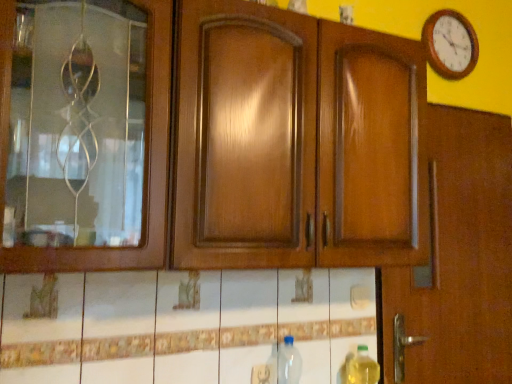
Image resolution: width=512 pixels, height=384 pixels. What do you see at coordinates (450, 44) in the screenshot?
I see `wooden clock at upper right` at bounding box center [450, 44].

Where is `transparent plastic bottle at lower center, which is counted as the 2th bottle, starting from the right`? The image size is (512, 384). transparent plastic bottle at lower center, which is counted as the 2th bottle, starting from the right is located at coordinates (289, 362).

The width and height of the screenshot is (512, 384). Identify the location of yellow translucent bottle at lower right, arranged as the first bottle when viewed from the right. (362, 368).

From the image's perspective, is wooden clock at upper right on top of transparent plastic bottle at lower center, arranged as the first bottle when viewed from the left?

Yes.

From a real-world perspective, between wooden clock at upper right and transparent plastic bottle at lower center, which is counted as the 2th bottle, starting from the right, who is vertically higher?

wooden clock at upper right is physically above.

Which bottle is the 2nd one when counting from the front of the wooden clock at upper right? Please provide its 2D coordinates.

[(289, 362)]

Is wooden clock at upper right positioned before transparent plastic bottle at lower center, which is counted as the 2th bottle, starting from the right?

No, the depth of wooden clock at upper right is greater than that of transparent plastic bottle at lower center, which is counted as the 2th bottle, starting from the right.

Could you tell me if yellow translucent bottle at lower right, which is the second bottle from left to right, is facing transparent plastic bottle at lower center, arranged as the first bottle when viewed from the left?

No, yellow translucent bottle at lower right, which is the second bottle from left to right, is not aimed at transparent plastic bottle at lower center, arranged as the first bottle when viewed from the left.

From the image's perspective, who appears lower, yellow translucent bottle at lower right, arranged as the first bottle when viewed from the right, or transparent plastic bottle at lower center, which is counted as the 2th bottle, starting from the right?

yellow translucent bottle at lower right, arranged as the first bottle when viewed from the right, is shown below in the image.

Visually, is yellow translucent bottle at lower right, which is the second bottle from left to right, positioned to the left or to the right of transparent plastic bottle at lower center, which is counted as the 2th bottle, starting from the right?

Based on their positions, yellow translucent bottle at lower right, which is the second bottle from left to right, is located to the right of transparent plastic bottle at lower center, which is counted as the 2th bottle, starting from the right.

Considering the sizes of objects yellow translucent bottle at lower right, arranged as the first bottle when viewed from the right, and transparent plastic bottle at lower center, arranged as the first bottle when viewed from the left, in the image provided, who is wider, yellow translucent bottle at lower right, arranged as the first bottle when viewed from the right, or transparent plastic bottle at lower center, arranged as the first bottle when viewed from the left,?

transparent plastic bottle at lower center, arranged as the first bottle when viewed from the left, is wider.

Considering the positions of points (462, 46) and (362, 345), is point (462, 46) farther from camera compared to point (362, 345)?

Yes, point (462, 46) is farther from viewer.

Visually, is wooden clock at upper right positioned to the left or to the right of yellow translucent bottle at lower right, arranged as the first bottle when viewed from the right?

Clearly, wooden clock at upper right is on the right of yellow translucent bottle at lower right, arranged as the first bottle when viewed from the right, in the image.

Consider the image. Are wooden clock at upper right and yellow translucent bottle at lower right, arranged as the first bottle when viewed from the right, located far from each other?

Yes.

Is transparent plastic bottle at lower center, arranged as the first bottle when viewed from the left, taller than yellow translucent bottle at lower right, which is the second bottle from left to right?

Correct, transparent plastic bottle at lower center, arranged as the first bottle when viewed from the left, is much taller as yellow translucent bottle at lower right, which is the second bottle from left to right.

Is point (286, 360) closer or farther from the camera than point (349, 366)?

Clearly, point (286, 360) is closer to the camera than point (349, 366).

From the image's perspective, which is above, transparent plastic bottle at lower center, which is counted as the 2th bottle, starting from the right, or yellow translucent bottle at lower right, arranged as the first bottle when viewed from the right?

transparent plastic bottle at lower center, which is counted as the 2th bottle, starting from the right, is shown above in the image.

What's the angular difference between transparent plastic bottle at lower center, which is counted as the 2th bottle, starting from the right, and yellow translucent bottle at lower right, arranged as the first bottle when viewed from the right,'s facing directions?

transparent plastic bottle at lower center, which is counted as the 2th bottle, starting from the right, and yellow translucent bottle at lower right, arranged as the first bottle when viewed from the right, are facing 0.000306 degrees away from each other.

From the image's perspective, is transparent plastic bottle at lower center, which is counted as the 2th bottle, starting from the right, located above or below wooden clock at upper right?

Based on their image positions, transparent plastic bottle at lower center, which is counted as the 2th bottle, starting from the right, is located beneath wooden clock at upper right.

How different are the orientations of transparent plastic bottle at lower center, which is counted as the 2th bottle, starting from the right, and wooden clock at upper right in degrees?

0.00437 degrees.

Looking at this image, which object is positioned more to the left, transparent plastic bottle at lower center, which is counted as the 2th bottle, starting from the right, or wooden clock at upper right?

transparent plastic bottle at lower center, which is counted as the 2th bottle, starting from the right.

Does point (286, 381) come closer to viewer compared to point (452, 16)?

Yes, point (286, 381) is in front of point (452, 16).

Does yellow translucent bottle at lower right, arranged as the first bottle when viewed from the right, have a lesser width compared to wooden clock at upper right?

Incorrect, the width of yellow translucent bottle at lower right, arranged as the first bottle when viewed from the right, is not less than that of wooden clock at upper right.

Can you confirm if yellow translucent bottle at lower right, arranged as the first bottle when viewed from the right, is smaller than wooden clock at upper right?

Indeed, yellow translucent bottle at lower right, arranged as the first bottle when viewed from the right, has a smaller size compared to wooden clock at upper right.

Considering the sizes of objects yellow translucent bottle at lower right, arranged as the first bottle when viewed from the right, and wooden clock at upper right in the image provided, who is taller, yellow translucent bottle at lower right, arranged as the first bottle when viewed from the right, or wooden clock at upper right?

wooden clock at upper right.

You are a GUI agent. You are given a task and a screenshot of the screen. Output one action in this format:
    pyautogui.click(x=<x>, y=<y>)
    Task: Click on the wall clock that appears above the transparent plastic bottle at lower center, arranged as the first bottle when viewed from the left (from the image's perspective)
    The height and width of the screenshot is (384, 512).
    Given the screenshot: What is the action you would take?
    pyautogui.click(x=450, y=44)

At what (x,y) coordinates should I click in order to perform the action: click on bottle in front of the yellow translucent bottle at lower right, arranged as the first bottle when viewed from the right. Please return your answer as a coordinate pair (x, y). The height and width of the screenshot is (384, 512). Looking at the image, I should click on (289, 362).

Which object lies nearer to the anchor point transparent plastic bottle at lower center, arranged as the first bottle when viewed from the left, wooden clock at upper right or yellow translucent bottle at lower right, arranged as the first bottle when viewed from the right?

Based on the image, yellow translucent bottle at lower right, arranged as the first bottle when viewed from the right, appears to be nearer to transparent plastic bottle at lower center, arranged as the first bottle when viewed from the left.

Which object lies further to the anchor point wooden clock at upper right, transparent plastic bottle at lower center, which is counted as the 2th bottle, starting from the right, or yellow translucent bottle at lower right, arranged as the first bottle when viewed from the right?

The object further to wooden clock at upper right is transparent plastic bottle at lower center, which is counted as the 2th bottle, starting from the right.

When comparing their distances from yellow translucent bottle at lower right, arranged as the first bottle when viewed from the right, does wooden clock at upper right or transparent plastic bottle at lower center, which is counted as the 2th bottle, starting from the right, seem further?

The object further to yellow translucent bottle at lower right, arranged as the first bottle when viewed from the right, is wooden clock at upper right.

Based on their spatial positions, is transparent plastic bottle at lower center, arranged as the first bottle when viewed from the left, or wooden clock at upper right further from yellow translucent bottle at lower right, arranged as the first bottle when viewed from the right?

Based on the image, wooden clock at upper right appears to be further to yellow translucent bottle at lower right, arranged as the first bottle when viewed from the right.

Considering their positions, is yellow translucent bottle at lower right, arranged as the first bottle when viewed from the right, positioned closer to transparent plastic bottle at lower center, which is counted as the 2th bottle, starting from the right, than wooden clock at upper right?

Based on the image, yellow translucent bottle at lower right, arranged as the first bottle when viewed from the right, appears to be nearer to transparent plastic bottle at lower center, which is counted as the 2th bottle, starting from the right.

Looking at the image, which one is located closer to wooden clock at upper right, yellow translucent bottle at lower right, arranged as the first bottle when viewed from the right, or transparent plastic bottle at lower center, arranged as the first bottle when viewed from the left?

The object closer to wooden clock at upper right is yellow translucent bottle at lower right, arranged as the first bottle when viewed from the right.

Where is `bottle that lies between wooden clock at upper right and yellow translucent bottle at lower right, which is the second bottle from left to right, from top to bottom`? This screenshot has height=384, width=512. bottle that lies between wooden clock at upper right and yellow translucent bottle at lower right, which is the second bottle from left to right, from top to bottom is located at coordinates (289, 362).